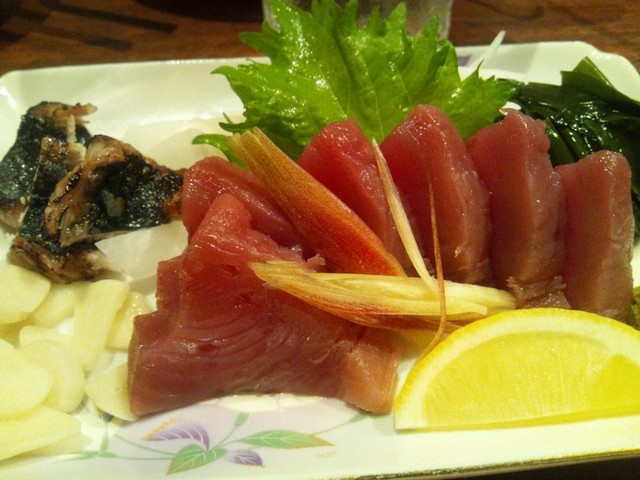
Where is `dark lines in table`? The width and height of the screenshot is (640, 480). dark lines in table is located at coordinates (86, 32), (139, 16), (221, 16).